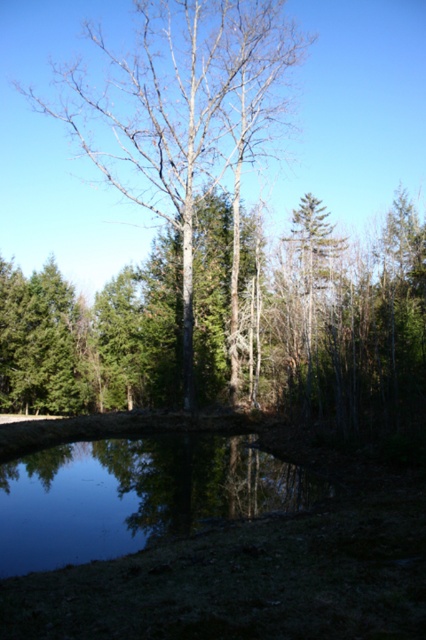
Question: Estimate the real-world distances between objects in this image. Which object is farther from the clear water at center?

Choices:
 (A) bare wood tree at center
 (B) green matte tree at center

Answer: (A)

Question: Can you confirm if green matte tree at center is positioned above clear water at center?

Choices:
 (A) yes
 (B) no

Answer: (A)

Question: Where is green matte tree at center located in relation to bare wood tree at center in the image?

Choices:
 (A) above
 (B) below

Answer: (B)

Question: Which object appears farthest from the camera in this image?

Choices:
 (A) green matte tree at center
 (B) clear water at center

Answer: (A)

Question: Can you confirm if bare wood tree at center is positioned above clear water at center?

Choices:
 (A) no
 (B) yes

Answer: (B)

Question: Which is farther from the clear water at center?

Choices:
 (A) bare wood tree at center
 (B) green matte tree at center

Answer: (A)